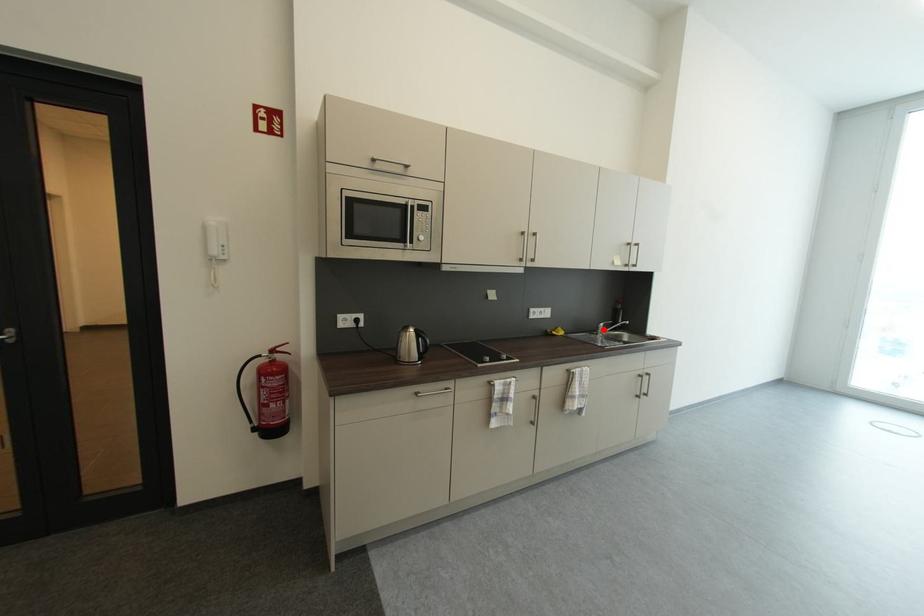
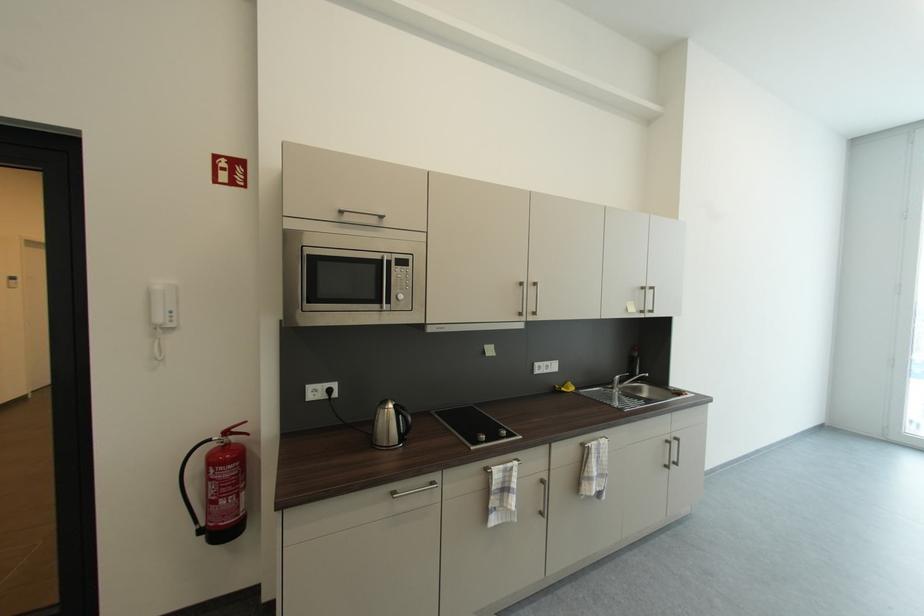
Where in the second image is the point corresponding to the highlighted location from the first image?

(618, 383)